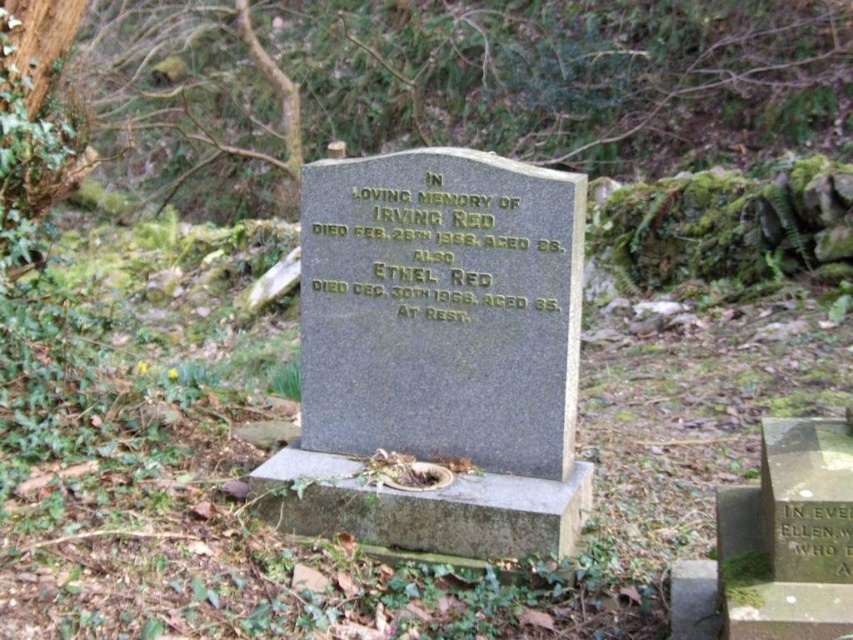
Who is shorter, goldmaterial/textureinscription at center or black stone inscription at lower right?

black stone inscription at lower right is shorter.

Is goldmaterial/textureinscription at center closer to camera compared to black stone inscription at lower right?

That is False.

Who is more distant from viewer, (509, 310) or (798, 536)?

Point (509, 310)

Image resolution: width=853 pixels, height=640 pixels. In order to click on goldmaterial/textureinscription at center in this screenshot , I will do `click(437, 243)`.